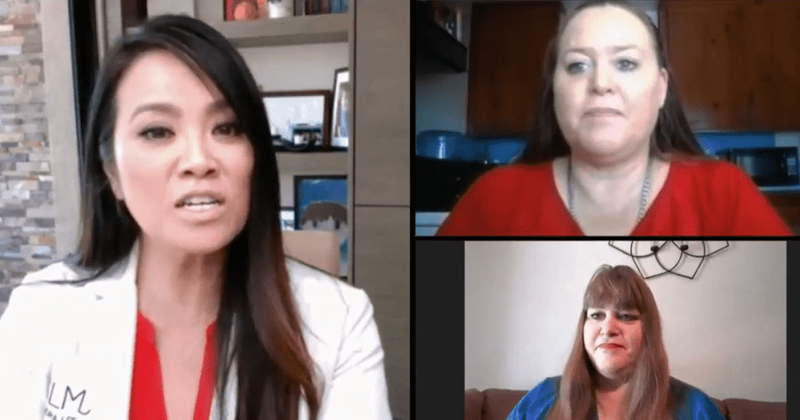
I want to click on pictures, so click(297, 124), click(317, 177), click(340, 119).